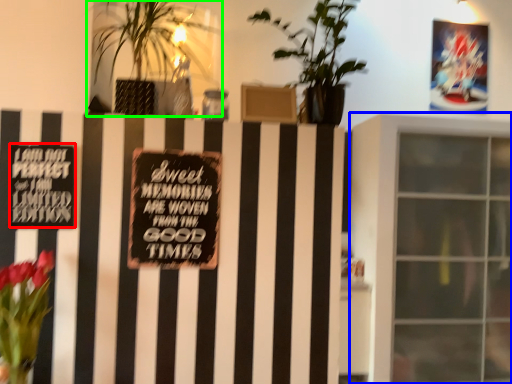
Question: Which is farther away from plaque (highlighted by a red box)? window (highlighted by a blue box) or houseplant (highlighted by a green box)?

Choices:
 (A) window
 (B) houseplant

Answer: (A)